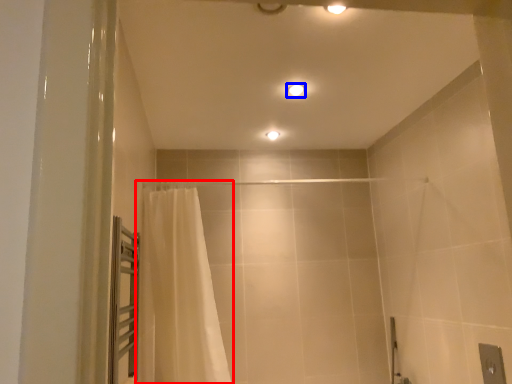
Question: Among these objects, which one is nearest to the camera, curtain (highlighted by a red box) or light fixture (highlighted by a blue box)?

Choices:
 (A) curtain
 (B) light fixture

Answer: (A)